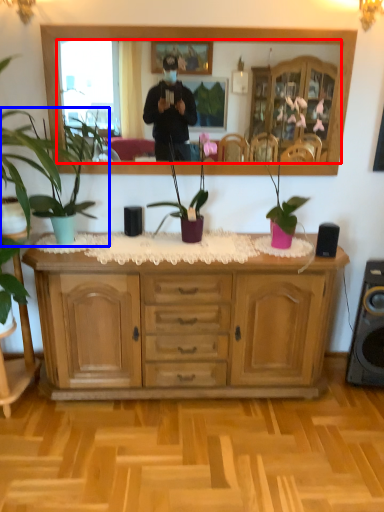
Question: Among these objects, which one is farthest to the camera, mirror (highlighted by a red box) or houseplant (highlighted by a blue box)?

Choices:
 (A) mirror
 (B) houseplant

Answer: (A)